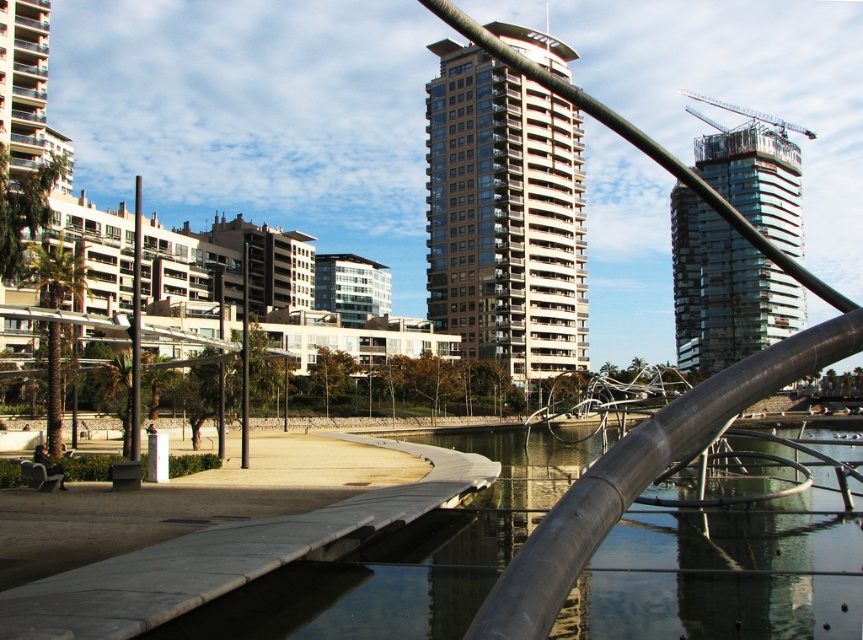
In the scene shown: Who is more distant from viewer, (463, 243) or (140, 256)?

The point (463, 243) is behind.

Who is positioned more to the right, beige glass building at center or smooth white pole at center?

beige glass building at center is more to the right.

What are the coordinates of `beige glass building at center` in the screenshot? It's located at (504, 216).

Where is `beige glass building at center`? This screenshot has height=640, width=863. beige glass building at center is located at coordinates (504, 216).

Which is below, smooth concrete river at center or smooth white pole at center?

smooth concrete river at center is below.

Between smooth concrete river at center and smooth white pole at center, which one has more height?

smooth white pole at center

Is point (707, 600) positioned in front of point (131, 365)?

Yes.

What are the coordinates of `smooth concrete river at center` in the screenshot? It's located at pyautogui.click(x=720, y=576).

The height and width of the screenshot is (640, 863). I want to click on black metal pole at center, so click(x=219, y=412).

Identify the location of black metal pole at center. (219, 412).